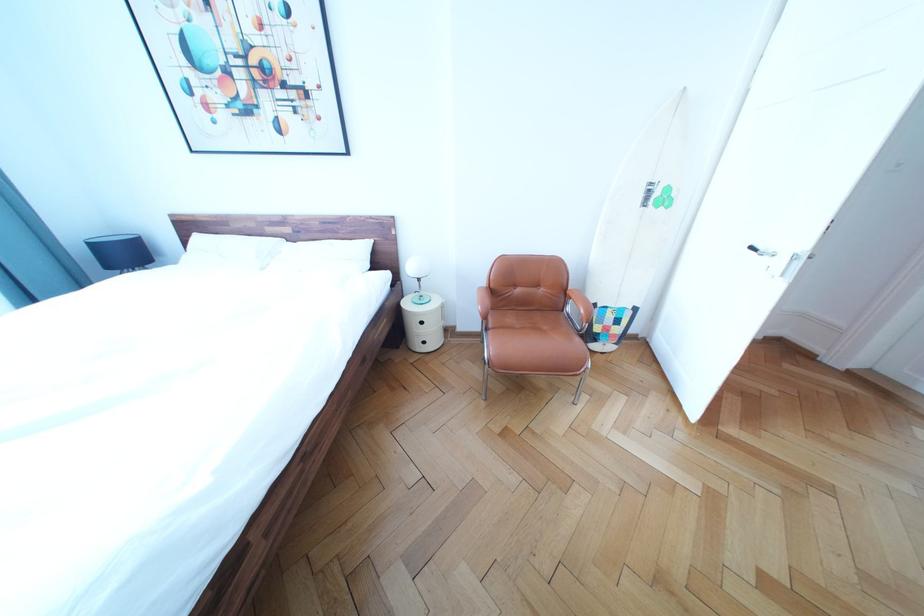
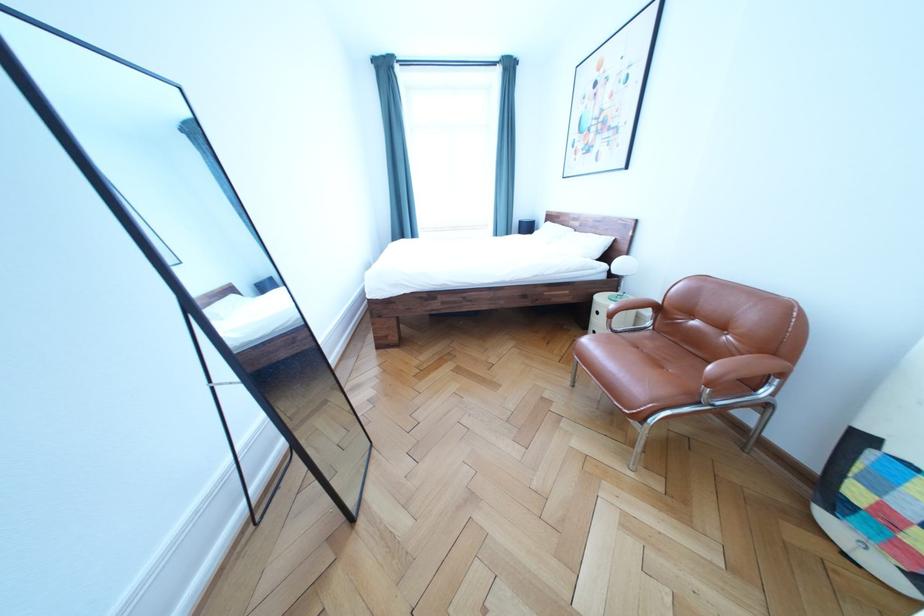
The point at [432,329] is marked in the first image. Where is the corresponding point in the second image?

(609, 318)